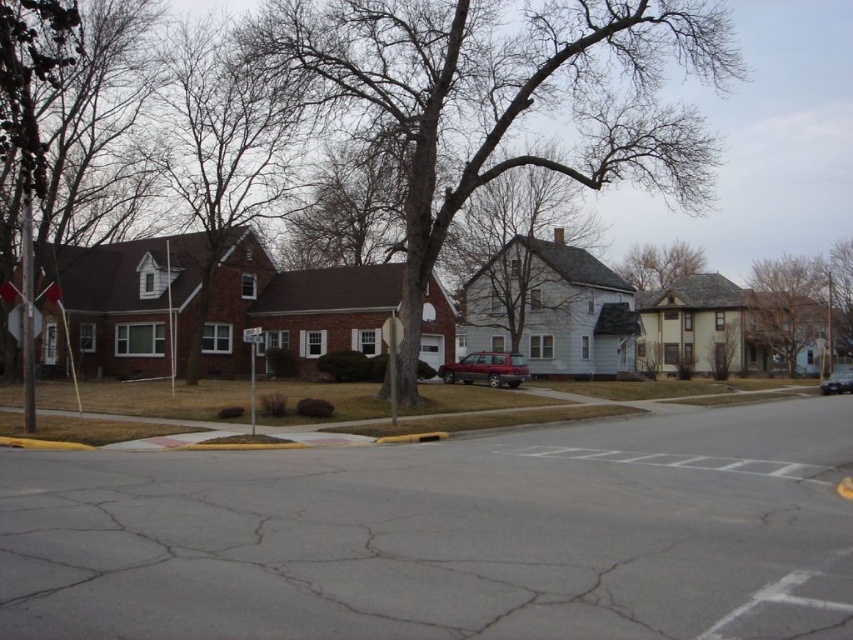
You are a bird flying over the residential street scene. You want to land on the highest point between the bare branches at upper center and the brown textured tree at upper center. Which one should you choose?

The bare branches at upper center is above the brown textured tree at upper center, so you should choose the bare branches at upper center to land on the highest point.

You are a pedestrian standing on the sidewalk and want to cross the street. There is a metallic silver stop sign at left and a shiny black car at lower right. Which object is taller?

The metallic silver stop sign at left is taller than the shiny black car at lower right according to the description.

You are standing on the sidewalk looking at the scene. Where exactly are the bare branches at upper center located in the image?

The bare branches at upper center are located at point (225, 141) in the image.